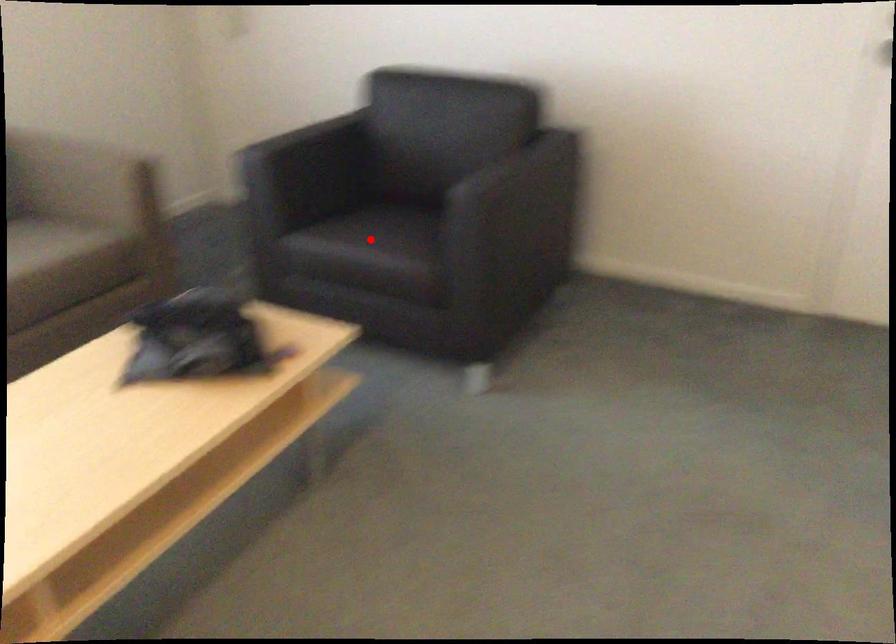
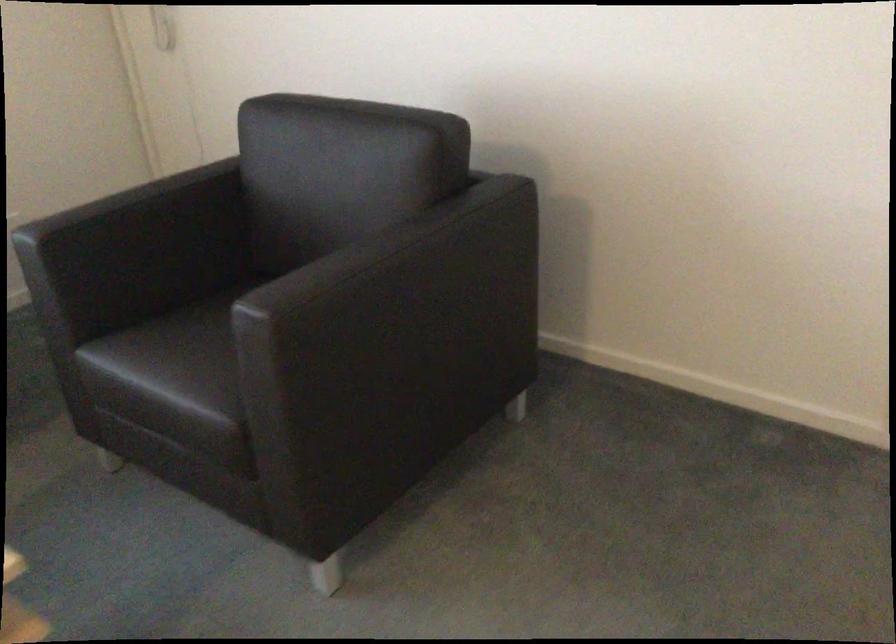
The point at the highlighted location is marked in the first image. Where is the corresponding point in the second image?

(168, 366)